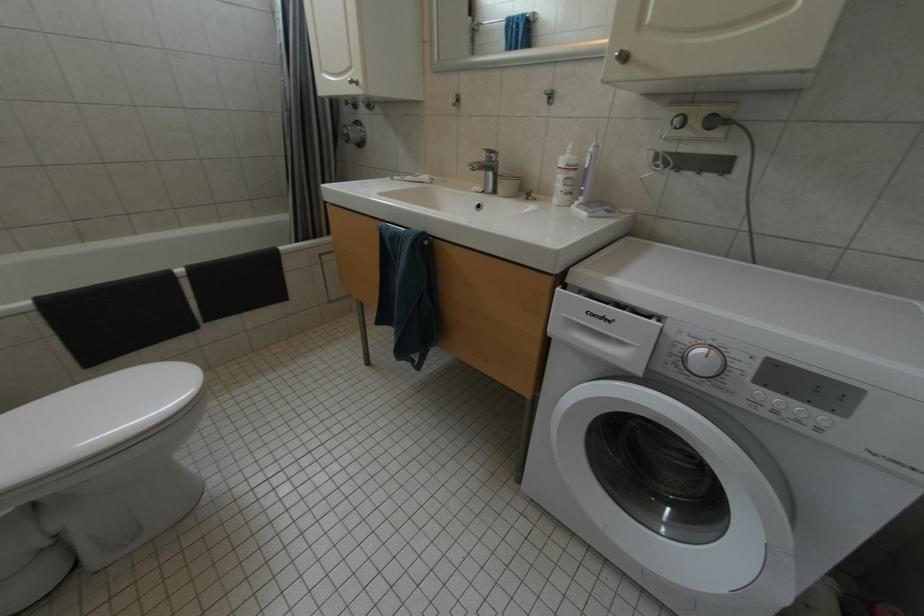
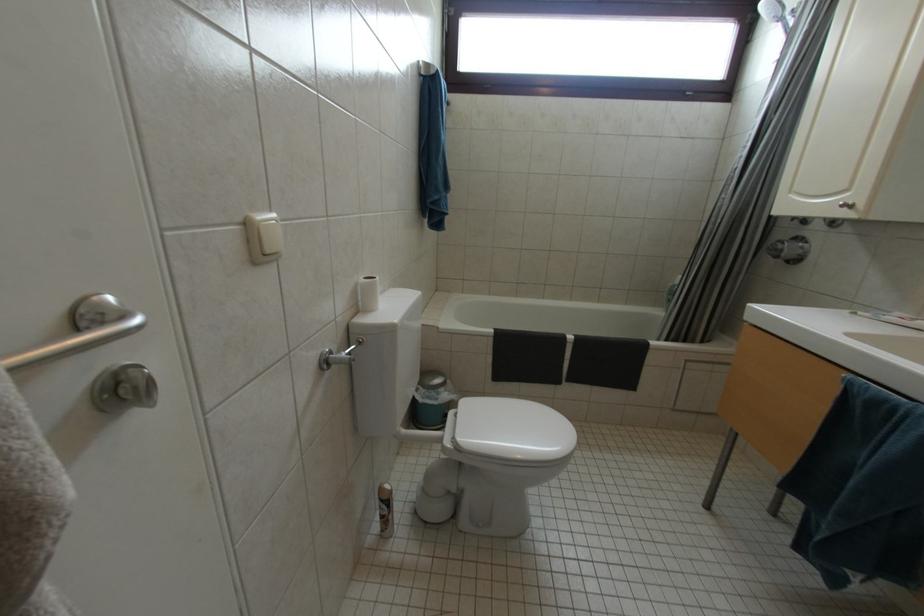
Question: The first image is from the beginning of the video and the second image is from the end. How did the camera likely rotate when shooting the video?

Choices:
 (A) Left
 (B) Right
 (C) Up
 (D) Down

Answer: (A)